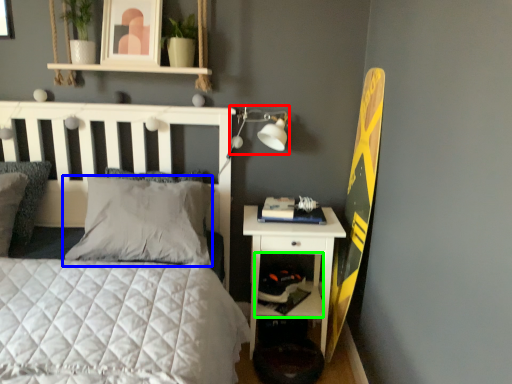
Question: Which object is positioned farthest from table lamp (highlighted by a red box)? Select from pillow (highlighted by a blue box) and shelf (highlighted by a green box).

Choices:
 (A) pillow
 (B) shelf

Answer: (B)